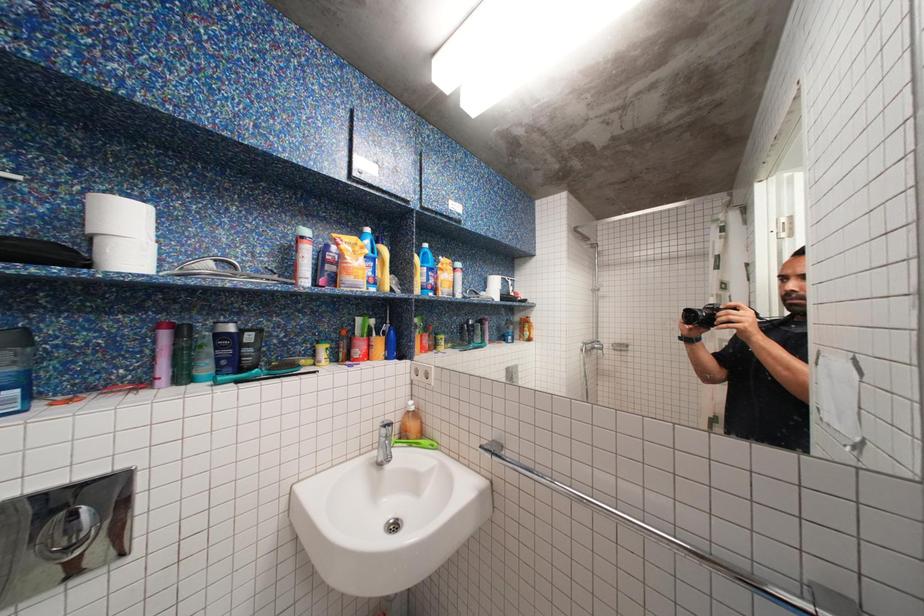
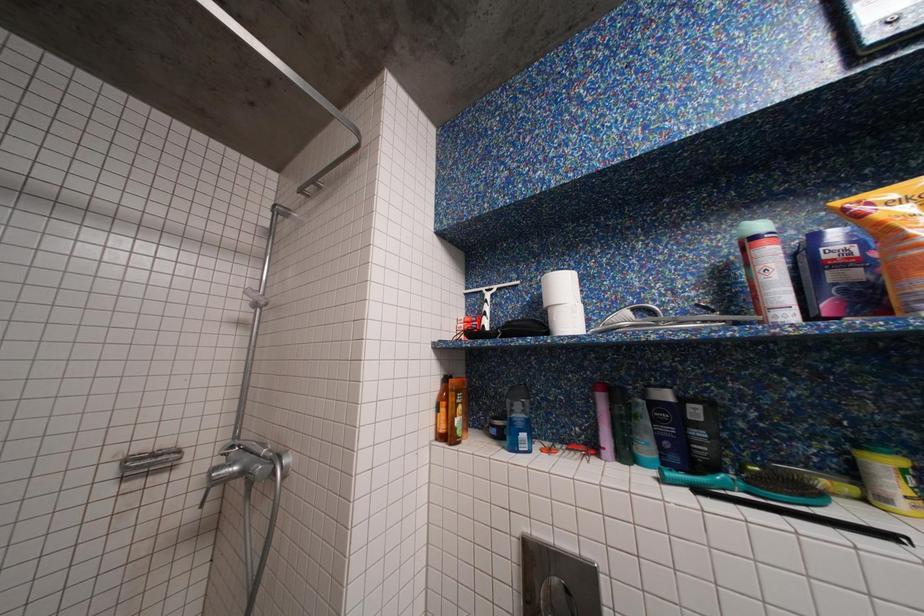
Question: How did the camera likely rotate?

Choices:
 (A) Left
 (B) Right
 (C) Up
 (D) Down

Answer: (A)